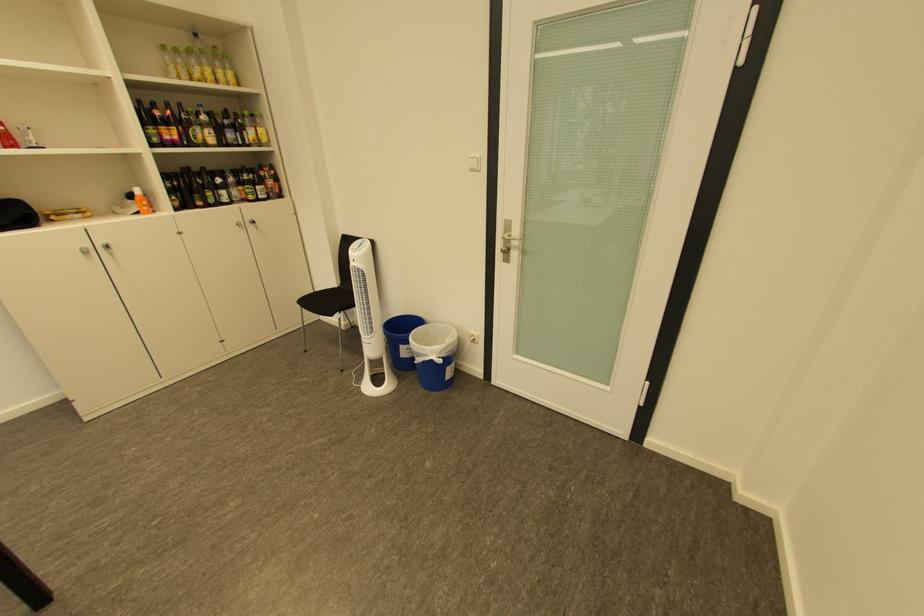
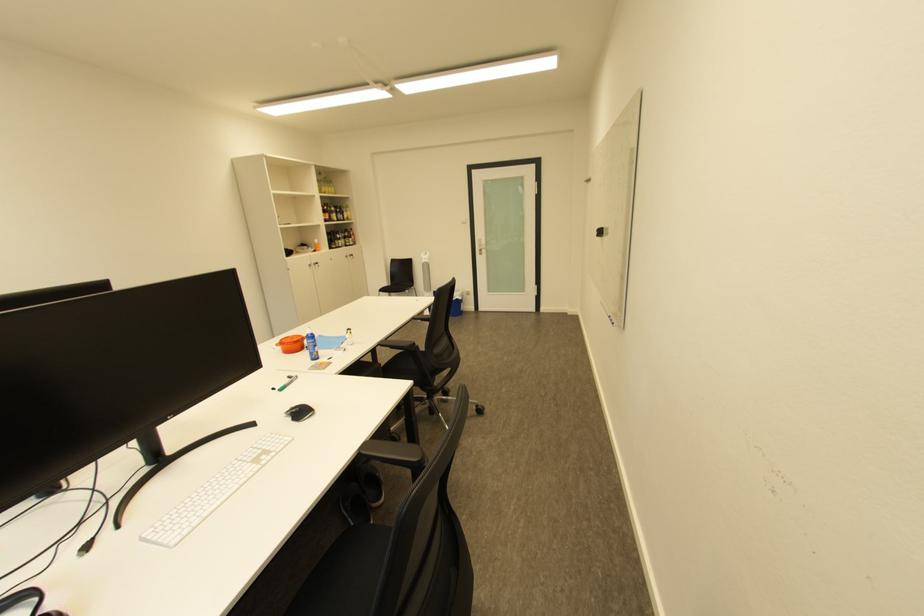
Based on the photo, in a continuous first-person perspective shot, in which direction is the camera moving?

The movement direction of the cameraman is left, backward.